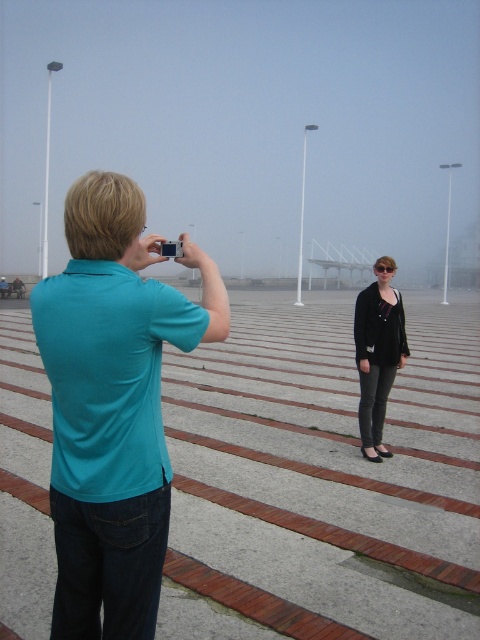
Which is more to the right, teal fabric shirt at left or black matte cardigan at center?

black matte cardigan at center is more to the right.

Is teal fabric shirt at left below black matte cardigan at center?

No.

Is point (73, 308) positioned in front of point (387, 320)?

Yes, point (73, 308) is closer to viewer.

Identify the location of teal fabric shirt at left. The height and width of the screenshot is (640, 480). (112, 404).